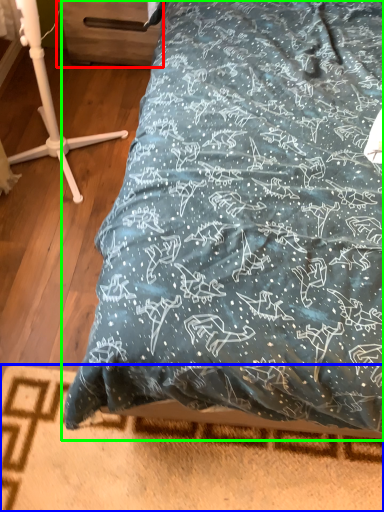
Question: Which is nearer to the drawer (highlighted by a red box)? bed frame (highlighted by a blue box) or bed (highlighted by a green box).

Choices:
 (A) bed frame
 (B) bed

Answer: (B)